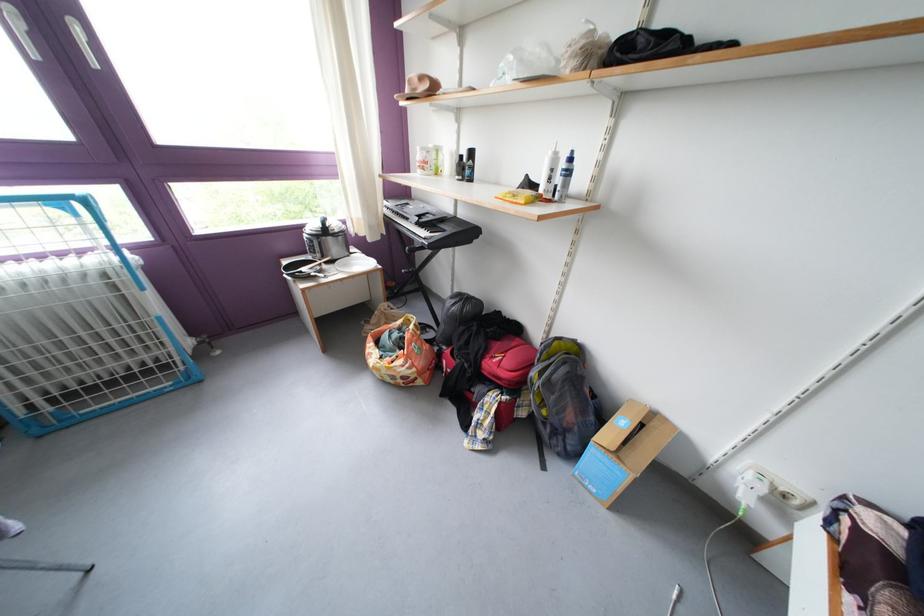
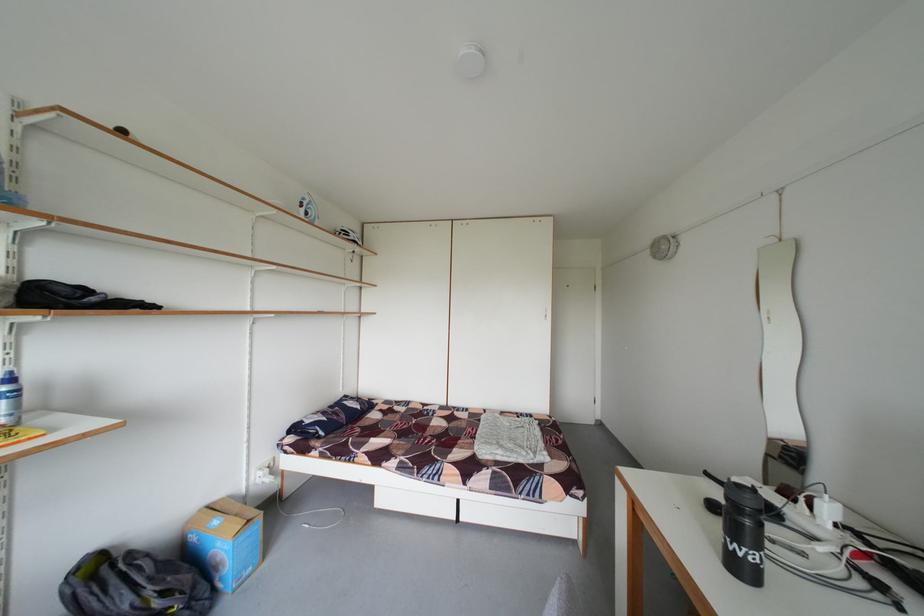
Find the pixel in the second image that matches pixel 685 434 in the first image.

(233, 505)